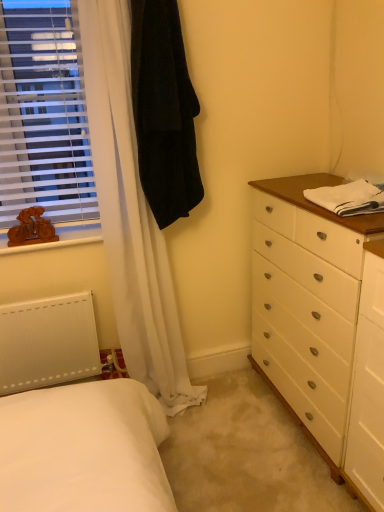
Measure the distance between black velvet robe at upper left and camera.

black velvet robe at upper left and camera are 1.52 meters apart.

What do you see at coordinates (60, 237) in the screenshot? I see `wooden figure at left` at bounding box center [60, 237].

The height and width of the screenshot is (512, 384). What do you see at coordinates (349, 198) in the screenshot?
I see `white cotton towel at right` at bounding box center [349, 198].

Locate an element on the screen. The height and width of the screenshot is (512, 384). black velvet robe at upper left is located at coordinates (164, 111).

From a real-world perspective, is wooden figure at left on top of white plastic blinds at left?

Incorrect, from a real-world perspective, wooden figure at left is lower than white plastic blinds at left.

Between wooden figure at left and white plastic blinds at left, which one appears on the left side from the viewer's perspective?

wooden figure at left.

Can you confirm if wooden figure at left is wider than white plastic blinds at left?

Correct, the width of wooden figure at left exceeds that of white plastic blinds at left.

Is white cotton towel at right with wooden figure at left?

No, white cotton towel at right is not touching wooden figure at left.

Considering the relative sizes of white cotton towel at right and wooden figure at left in the image provided, is white cotton towel at right smaller than wooden figure at left?

Incorrect, white cotton towel at right is not smaller in size than wooden figure at left.

Relative to wooden figure at left, is white cotton towel at right in front or behind?

Visually, white cotton towel at right is located in front of wooden figure at left.

You are a GUI agent. You are given a task and a screenshot of the screen. Output one action in this format:
    pyautogui.click(x=<x>, y=<y>)
    Task: Click on the radiator lying behind the white cotton towel at right
    The width and height of the screenshot is (384, 512).
    Given the screenshot: What is the action you would take?
    pyautogui.click(x=47, y=342)

Measure the distance from white cotton towel at right to white matte radiator at lower left.

The distance of white cotton towel at right from white matte radiator at lower left is 1.28 meters.

Which of these two, white cotton towel at right or white matte radiator at lower left, is smaller?

white cotton towel at right is smaller.

From the image's perspective, which one is positioned higher, white cotton towel at right or white plastic blinds at left?

white plastic blinds at left appears higher in the image.

Consider the image. Considering the relative positions of white cotton towel at right and white plastic blinds at left in the image provided, is white cotton towel at right to the left or to the right of white plastic blinds at left?

Based on their positions, white cotton towel at right is located to the right of white plastic blinds at left.

From a real-world perspective, between white matte radiator at lower left and black velvet robe at upper left, who is vertically lower?

white matte radiator at lower left is physically lower.

Would you say white matte radiator at lower left is to the left or to the right of black velvet robe at upper left in the picture?

From the image, it's evident that white matte radiator at lower left is to the left of black velvet robe at upper left.

Is white matte radiator at lower left positioned with its back to black velvet robe at upper left?

white matte radiator at lower left is not turned away from black velvet robe at upper left.

In terms of width, does white matte radiator at lower left look wider or thinner when compared to white plastic blinds at left?

Considering their sizes, white matte radiator at lower left looks broader than white plastic blinds at left.

From a real-world perspective, between white matte radiator at lower left and white plastic blinds at left, who is vertically higher?

From a 3D spatial view, white plastic blinds at left is above.

This screenshot has height=512, width=384. What are the coordinates of `window on the right of white matte radiator at lower left` in the screenshot? It's located at (43, 113).

Considering the sizes of white matte radiator at lower left and white plastic blinds at left in the image, is white matte radiator at lower left taller or shorter than white plastic blinds at left?

Clearly, white matte radiator at lower left is shorter compared to white plastic blinds at left.

In the scene shown: Is white matte radiator at lower left wider or thinner than white cotton towel at right?

Considering their sizes, white matte radiator at lower left looks slimmer than white cotton towel at right.

Is white matte radiator at lower left turned away from white cotton towel at right?

white matte radiator at lower left does not have its back to white cotton towel at right.

From the picture: From the image's perspective, is white matte radiator at lower left on top of white cotton towel at right?

Incorrect, from the image's perspective, white matte radiator at lower left is lower than white cotton towel at right.

The width and height of the screenshot is (384, 512). What are the coordinates of `window above the wooden figure at left (from the image's perspective)` in the screenshot? It's located at (43, 113).

This screenshot has width=384, height=512. I want to click on window sill that is below the white cotton towel at right (from the image's perspective), so click(60, 237).

Based on their spatial positions, is white cotton towel at right or white plastic blinds at left further from wooden figure at left?

white cotton towel at right is positioned further to the anchor wooden figure at left.

From the image, which object appears to be farther from wooden figure at left, white matte radiator at lower left or white cotton towel at right?

white cotton towel at right is further to wooden figure at left.

From the image, which object appears to be farther from wooden figure at left, white plastic blinds at left or black velvet robe at upper left?

Among the two, black velvet robe at upper left is located further to wooden figure at left.

Looking at the image, which one is located closer to white plastic blinds at left, black velvet robe at upper left or wooden figure at left?

wooden figure at left lies closer to white plastic blinds at left than the other object.

Which object lies further to the anchor point white plastic blinds at left, white cotton towel at right or black velvet robe at upper left?

Based on the image, white cotton towel at right appears to be further to white plastic blinds at left.

From the image, which object appears to be farther from black velvet robe at upper left, white matte radiator at lower left or white cotton towel at right?

Based on the image, white matte radiator at lower left appears to be further to black velvet robe at upper left.

Considering their positions, is wooden figure at left positioned further to white matte radiator at lower left than black velvet robe at upper left?

Based on the image, black velvet robe at upper left appears to be further to white matte radiator at lower left.

From the image, which object appears to be farther from wooden figure at left, white plastic blinds at left or white matte radiator at lower left?

white matte radiator at lower left is further to wooden figure at left.

Where is `window sill between white plastic blinds at left and white matte radiator at lower left vertically`? window sill between white plastic blinds at left and white matte radiator at lower left vertically is located at coordinates (60, 237).

Locate an element on the screen. window sill between black velvet robe at upper left and white matte radiator at lower left from top to bottom is located at coordinates (60, 237).

Locate an element on the screen. window between black velvet robe at upper left and white matte radiator at lower left in the vertical direction is located at coordinates (43, 113).

I want to click on window between wooden figure at left and white cotton towel at right in the horizontal direction, so click(43, 113).